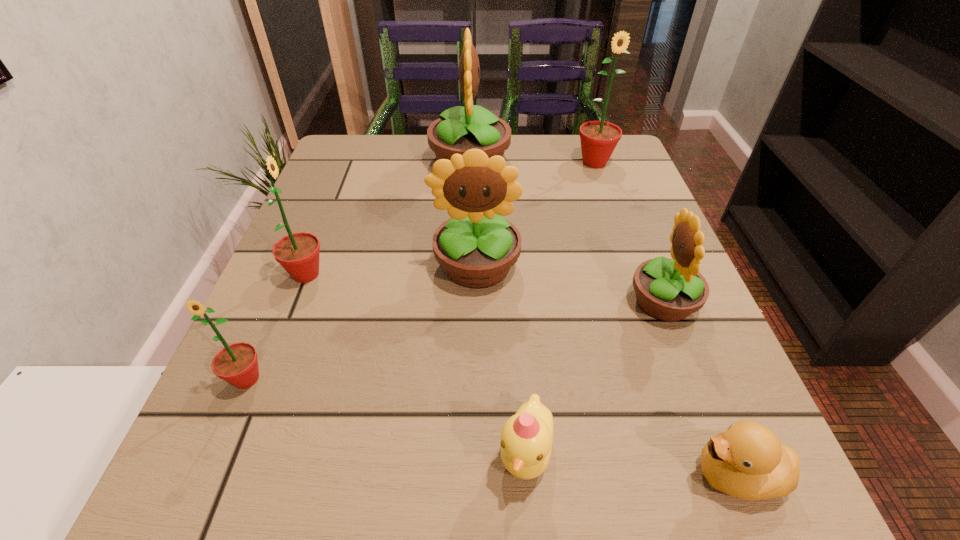
The image size is (960, 540). Identify the location of the farthest yellow sunflower. (458, 129).

You are a GUI agent. You are given a task and a screenshot of the screen. Output one action in this format:
    pyautogui.click(x=<x>, y=<y>)
    Task: Click on the farthest green sunflower
    The image size is (960, 540).
    Given the screenshot: What is the action you would take?
    pyautogui.click(x=598, y=139)

Where is `the rightmost green sunflower`? The width and height of the screenshot is (960, 540). the rightmost green sunflower is located at coordinates (598, 139).

At what (x,y) coordinates should I click in order to perform the action: click on the second biggest yellow sunflower. Please return your answer as a coordinate pair (x, y). The width and height of the screenshot is (960, 540). Looking at the image, I should click on (476, 247).

The height and width of the screenshot is (540, 960). I want to click on the second farthest green sunflower, so click(298, 253).

Identify the location of the rightmost yellow sunflower. (669, 290).

Find the location of a particular element. The width and height of the screenshot is (960, 540). the nearest green sunflower is located at coordinates (237, 363).

Find the location of a particular element. The height and width of the screenshot is (540, 960). the nearest sunflower is located at coordinates (237, 363).

Locate an element on the screen. The width and height of the screenshot is (960, 540). the left duckling is located at coordinates (526, 438).

You are a GUI agent. You are given a task and a screenshot of the screen. Output one action in this format:
    pyautogui.click(x=<x>, y=<y>)
    Task: Click on the right duckling
    
    Given the screenshot: What is the action you would take?
    pyautogui.click(x=747, y=461)